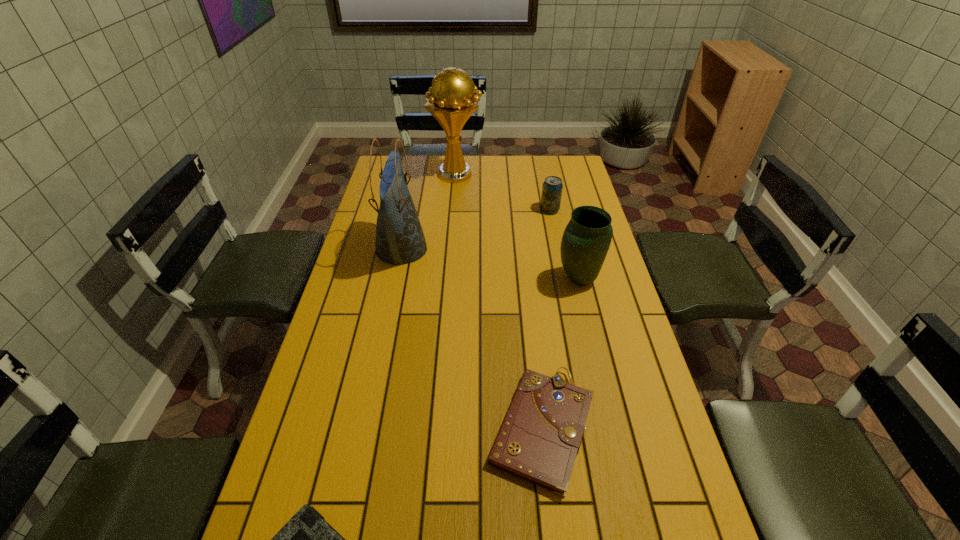
The height and width of the screenshot is (540, 960). What are the coordinates of `free space that satisfies the following two spatial constraints: 1. on the front side of the fifth tallest object; 2. on the left side of the shopping bag` in the screenshot? It's located at (365, 428).

Where is `vacant region that satisfies the following two spatial constraints: 1. at the front of the trophy_cup where the globe is prominent; 2. on the back side of the fourth shortest object`? The height and width of the screenshot is (540, 960). vacant region that satisfies the following two spatial constraints: 1. at the front of the trophy_cup where the globe is prominent; 2. on the back side of the fourth shortest object is located at coordinates (448, 279).

At what (x,y) coordinates should I click in order to perform the action: click on free space in the image that satisfies the following two spatial constraints: 1. at the front of the second nearest object where the globe is prominent; 2. on the right side of the farthest object. Please return your answer as a coordinate pair (x, y). The image size is (960, 540). Looking at the image, I should click on (437, 428).

Where is `vacant space that satisfies the following two spatial constraints: 1. at the front of the vase where the globe is prominent; 2. on the left side of the trophy_cup`? vacant space that satisfies the following two spatial constraints: 1. at the front of the vase where the globe is prominent; 2. on the left side of the trophy_cup is located at coordinates 448,279.